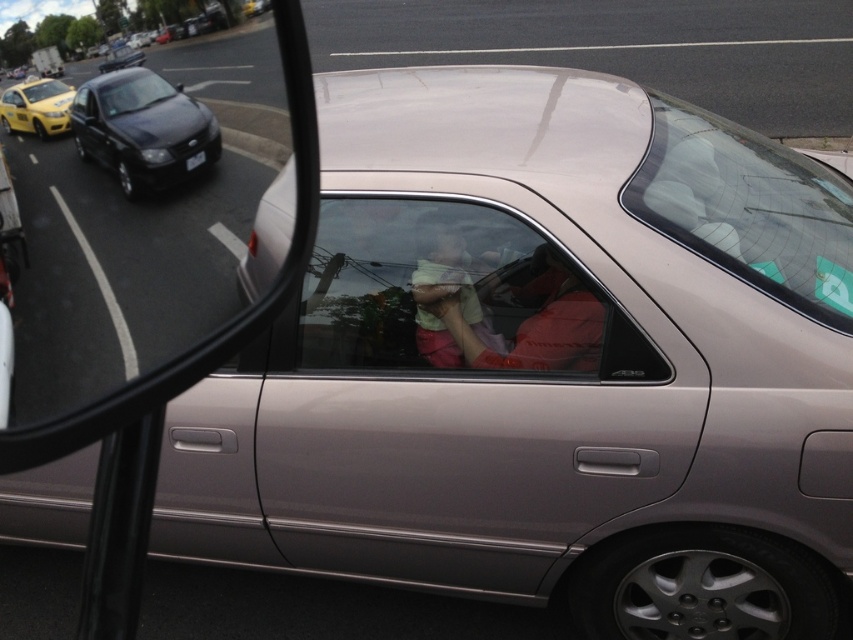
From the picture: You are a passenger in the silver sedan parked on the right. You notice the matte green shirt at center and the yellow matte taxi at upper left in your side mirror. Which object in the mirror appears larger?

The matte green shirt at center appears larger than the yellow matte taxi at upper left because it is closer to the mirror.

You are a passenger in the silver sedan parked on the right. You look through the side mirror and see the yellow matte taxi at upper left and the matte green shirt at center. Which object is farther from you?

The yellow matte taxi at upper left is farther from you because it is behind the matte green shirt at center.

You are a passenger in the silver sedan parked on the right. You want to look through the clear glass windshield at upper center to see the yellow taxi and black sedan outside. Is the clear glass windshield at upper center positioned at point (747, 208)?

Yes, the clear glass windshield at upper center is located at point (747, 208), so you can look through it to see the yellow taxi and black sedan outside.